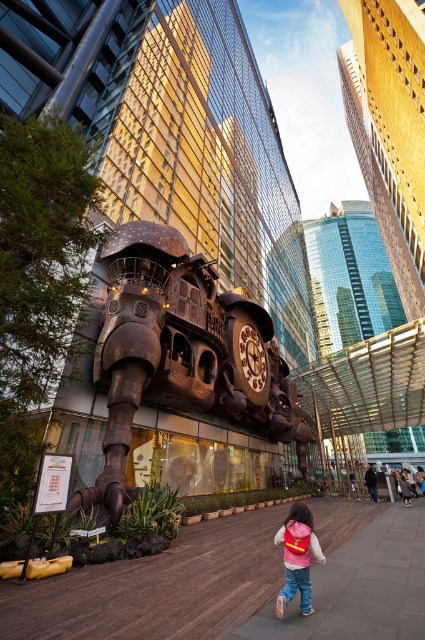
Looking at this image, is shiny bronze clock at center to the left of pink fabric backpack at lower right from the viewer's perspective?

Correct, you'll find shiny bronze clock at center to the left of pink fabric backpack at lower right.

How distant is shiny bronze clock at center from pink fabric backpack at lower right?

shiny bronze clock at center is 33.05 feet away from pink fabric backpack at lower right.

I want to click on shiny bronze clock at center, so click(181, 353).

The height and width of the screenshot is (640, 425). Identify the location of shiny bronze clock at center. (181, 353).